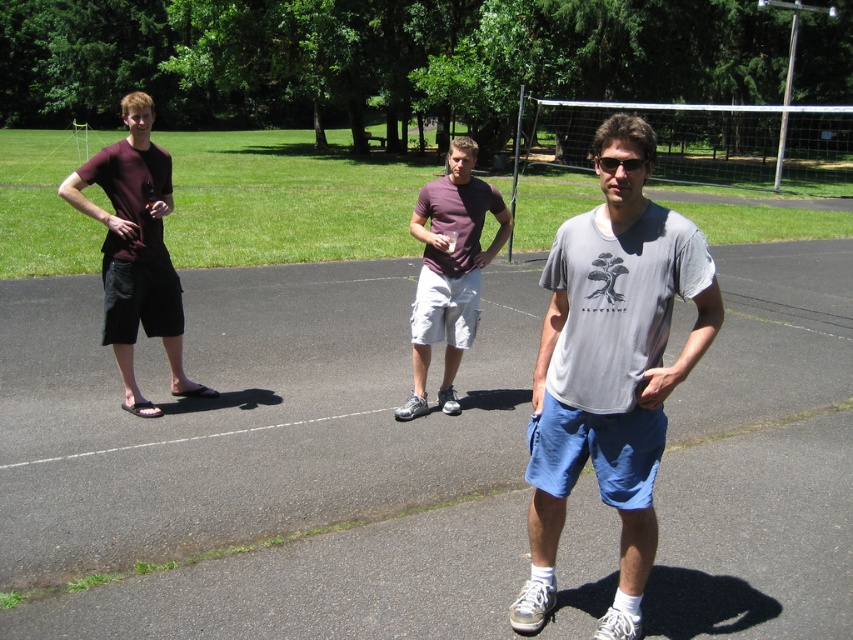
Question: Does purple cotton t-shirt at center appear on the right side of black plastic sunglasses at center?

Choices:
 (A) no
 (B) yes

Answer: (A)

Question: Which point appears closest to the camera in this image?

Choices:
 (A) (152, 209)
 (B) (834, 608)
 (C) (631, 161)

Answer: (C)

Question: Based on their relative distances, which object is nearer to the purple cotton t-shirt at center?

Choices:
 (A) blue fabric shorts at center
 (B) black plastic sunglasses at center

Answer: (A)

Question: Does gray cotton t-shirt at center have a smaller size compared to purple cotton t-shirt at center?

Choices:
 (A) no
 (B) yes

Answer: (A)

Question: Where is gray cotton t-shirt at center located in relation to matte black shorts at left in the image?

Choices:
 (A) left
 (B) right

Answer: (B)

Question: Among these points, which one is nearest to the camera?

Choices:
 (A) (172, 275)
 (B) (640, 220)
 (C) (767, 417)
 (D) (608, 161)

Answer: (D)